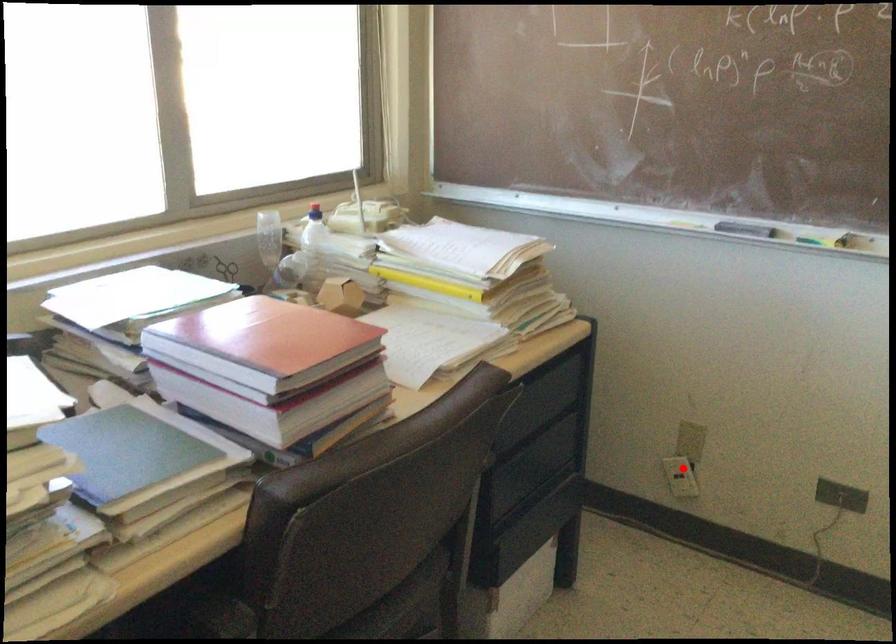
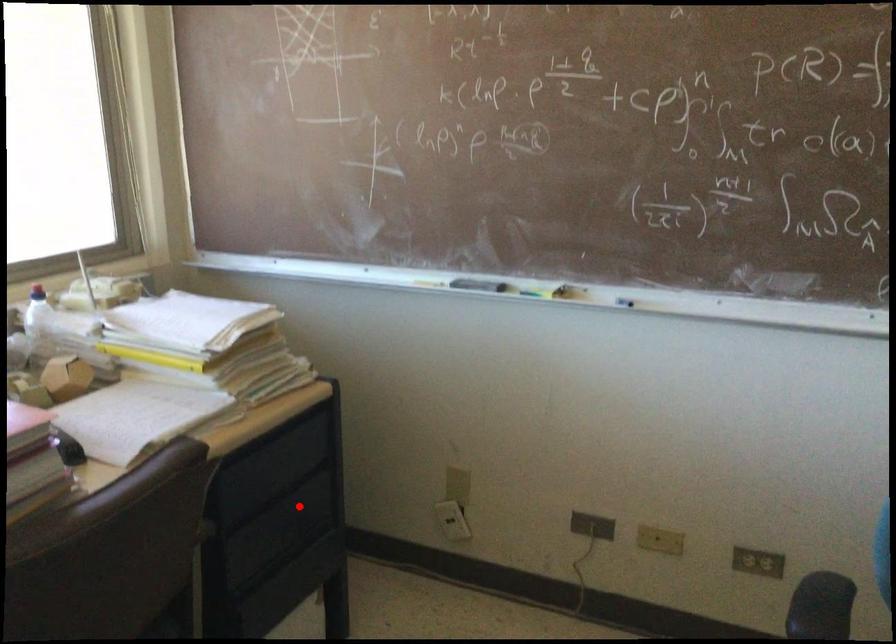
Consider the image. I am providing you with two images of the same scene from different viewpoints. A red point is marked on the first image and another point is marked on the second image. Are the points marked in image1 and image2 representing the same 3D position?

No